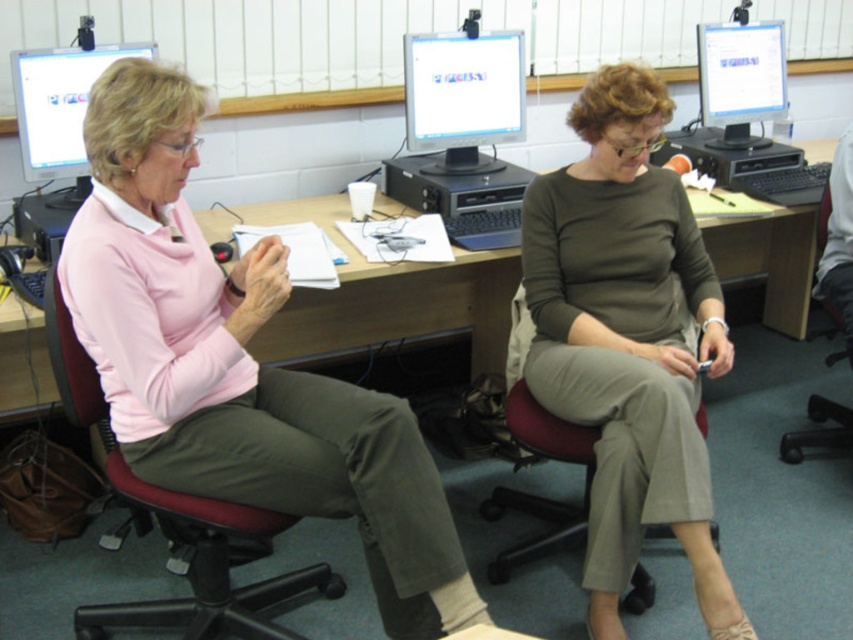
Question: Is wooden desk at center wider than matte black monitor at upper left?

Choices:
 (A) yes
 (B) no

Answer: (A)

Question: Among these objects, which one is nearest to the camera?

Choices:
 (A) matte olive-green blouse at center
 (B) pink matte sweater at left
 (C) matte black monitor at upper left

Answer: (B)

Question: Which object appears closest to the camera in this image?

Choices:
 (A) pink matte sweater at left
 (B) wooden desk at center
 (C) dark red leather swivel chair at left

Answer: (A)

Question: Can you confirm if pink matte sweater at left is positioned above dark red leather swivel chair at left?

Choices:
 (A) yes
 (B) no

Answer: (A)

Question: Based on their relative distances, which object is nearer to the pink matte sweater at left?

Choices:
 (A) dark red leather swivel chair at left
 (B) matte olive-green blouse at center
 (C) matte black monitor at upper left

Answer: (A)

Question: Is wooden desk at center positioned behind matte black monitor at upper left?

Choices:
 (A) no
 (B) yes

Answer: (B)